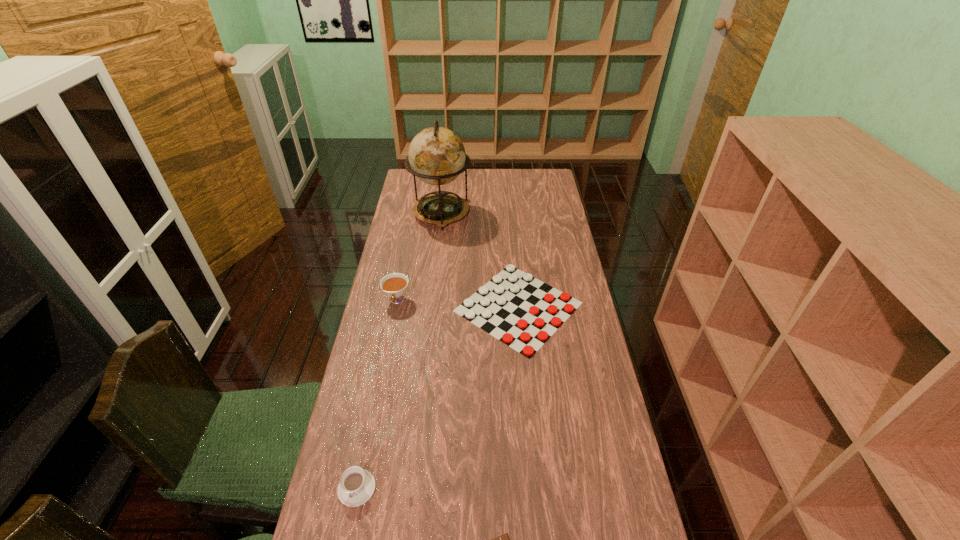
Where is `globe present at the left edge`? The width and height of the screenshot is (960, 540). globe present at the left edge is located at coordinates (437, 156).

Identify the location of object located at the right edge. This screenshot has width=960, height=540. (525, 326).

Locate an element on the screen. vacant area at the far edge is located at coordinates (460, 181).

The height and width of the screenshot is (540, 960). In the image, there is a desktop. Identify the location of vacant space at the left edge. (396, 373).

At what (x,y) coordinates should I click in order to perform the action: click on vacant region at the right edge of the desktop. Please return your answer as a coordinate pair (x, y). The height and width of the screenshot is (540, 960). Looking at the image, I should click on (586, 386).

The height and width of the screenshot is (540, 960). I want to click on vacant space at the far left corner, so click(x=407, y=182).

Locate an element on the screen. The image size is (960, 540). vacant point located between the farthest object and the farther teacup is located at coordinates (419, 257).

In order to click on vacant area between the farther teacup and the third shortest object in this screenshot , I will do `click(377, 394)`.

I want to click on vacant space that is in between the nearer teacup and the second shortest object, so [438, 397].

Find the location of a particular element. vacant space in between the nearer teacup and the second tallest object is located at coordinates (377, 394).